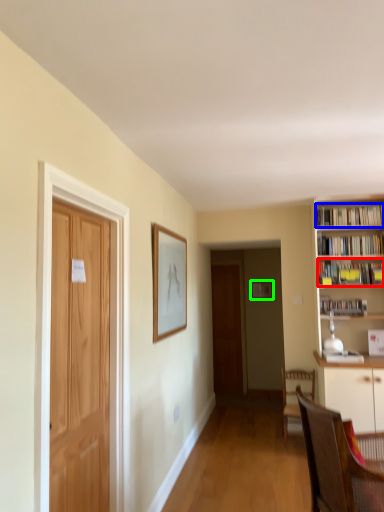
Question: Which object is positioned farthest from book (highlighted by a red box)? Select from book (highlighted by a blue box) and picture frame (highlighted by a green box).

Choices:
 (A) book
 (B) picture frame

Answer: (B)